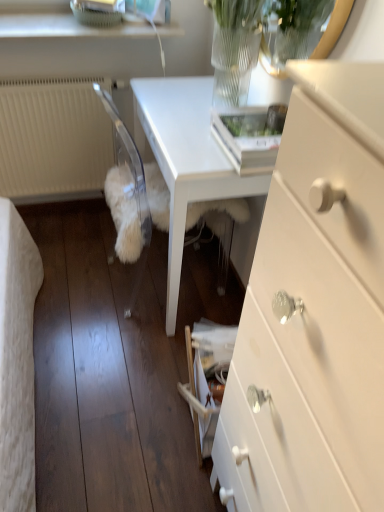
This screenshot has width=384, height=512. In order to click on blank space situated above white glossy table at center (from a real-world perspective) in this screenshot , I will do `click(188, 111)`.